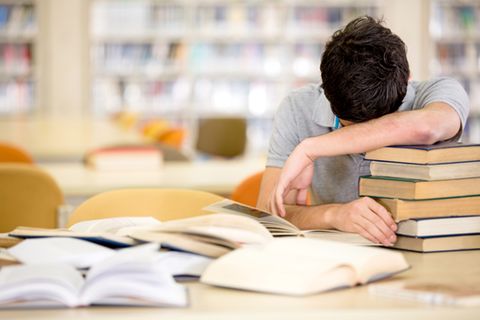
Image resolution: width=480 pixels, height=320 pixels. What are the coordinates of `book in stack` in the screenshot? It's located at tap(430, 245), tap(432, 228), tap(435, 209), tap(436, 187), tap(442, 170), tap(445, 154).